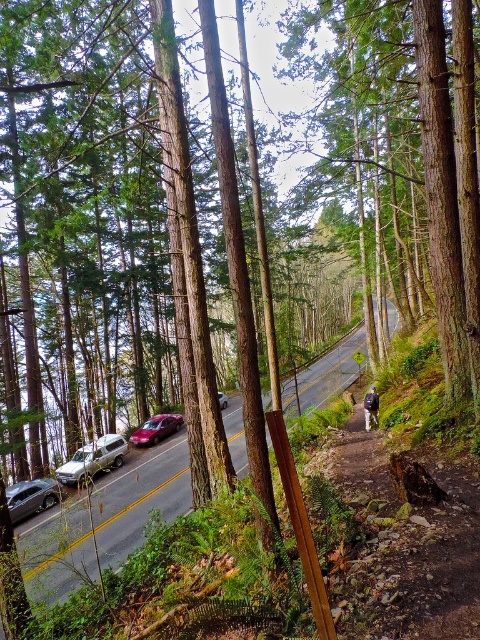
You are a hiker standing at point (x=372, y=403) and want to reach point (x=16, y=516). Given that the road curves gently to the right, which direction should you walk along the road to reach your destination?

You should walk forward along the road because point (x=16, y=516) is behind point (x=372, y=403), meaning it is in the direction you are facing as you stand at point (x=372, y=403). Since the road curves gently to the right, continue following the road in the forward direction to reach your destination.